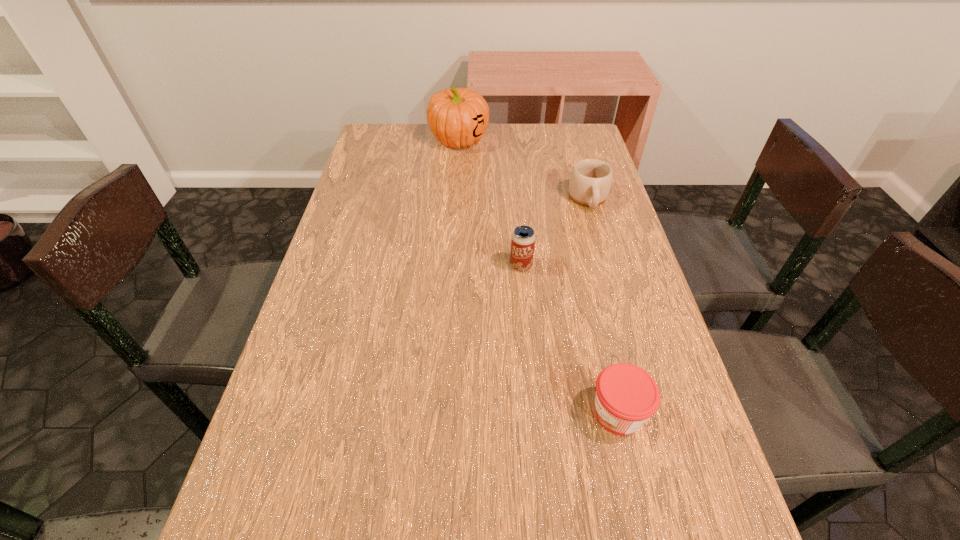
You are a GUI agent. You are given a task and a screenshot of the screen. Output one action in this format:
    pyautogui.click(x=<x>, y=<y>)
    Task: Click on the leftmost object
    
    Given the screenshot: What is the action you would take?
    pyautogui.click(x=457, y=117)

Identify the location of the tallest object. (457, 117).

In order to click on the third farthest object in this screenshot , I will do `click(523, 238)`.

In order to click on the second object from left to right in this screenshot , I will do `click(523, 238)`.

Where is `mug`? mug is located at coordinates (590, 181).

Identify the location of jam. The width and height of the screenshot is (960, 540). (626, 396).

Where is `free region located on the surface of the leftmost object`? free region located on the surface of the leftmost object is located at coordinates (453, 234).

Locate an element on the screen. Image resolution: width=960 pixels, height=540 pixels. vacant space situated 0.110m on the front of the second object from left to right is located at coordinates (525, 308).

This screenshot has height=540, width=960. What are the coordinates of `free spot located 0.090m on the side of the mug with the handle` in the screenshot? It's located at (599, 237).

This screenshot has height=540, width=960. What are the coordinates of `vacant space located on the label side of the nearest object` in the screenshot? It's located at (386, 413).